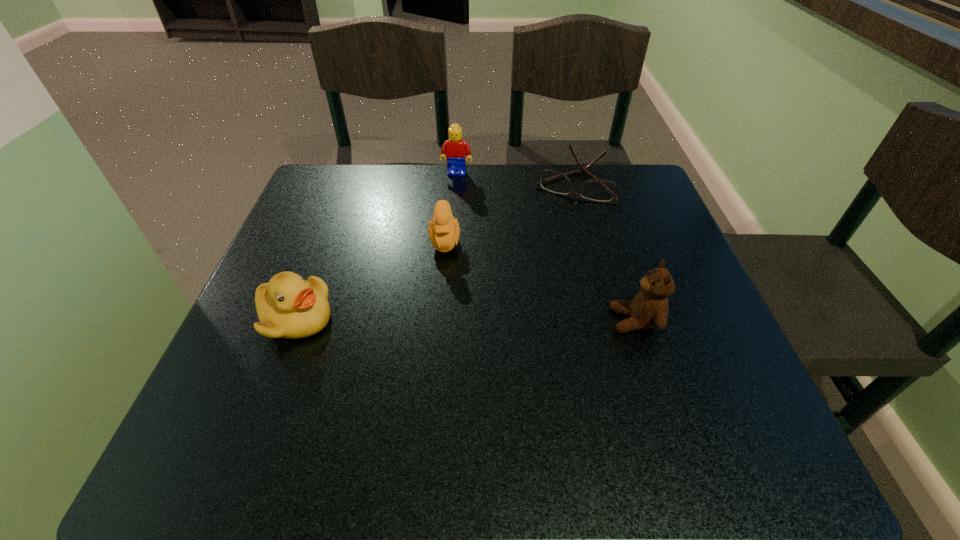
You are a GUI agent. You are given a task and a screenshot of the screen. Output one action in this format:
    pyautogui.click(x=<x>, y=<y>)
    Task: Click on the left duckling
    The image size is (960, 540).
    Given the screenshot: What is the action you would take?
    pyautogui.click(x=288, y=306)

Locate an element on the screen. the leftmost object is located at coordinates (288, 306).

This screenshot has height=540, width=960. In order to click on teddy bear in this screenshot , I will do `click(649, 308)`.

The width and height of the screenshot is (960, 540). Find the location of `the third nearest object`. the third nearest object is located at coordinates (444, 231).

Find the location of `the right duckling`. the right duckling is located at coordinates (444, 231).

The width and height of the screenshot is (960, 540). What are the coordinates of `the shortest object` in the screenshot? It's located at (598, 190).

What are the coordinates of `Lego` in the screenshot? It's located at (456, 149).

Locate an element on the screen. Image resolution: width=960 pixels, height=540 pixels. vacant point located on the front-facing side of the leftmost object is located at coordinates (522, 318).

Where is `free space located at the face of the teddy bear`? The width and height of the screenshot is (960, 540). free space located at the face of the teddy bear is located at coordinates (504, 321).

This screenshot has width=960, height=540. I want to click on free space located 0.160m at the face of the teddy bear, so click(525, 321).